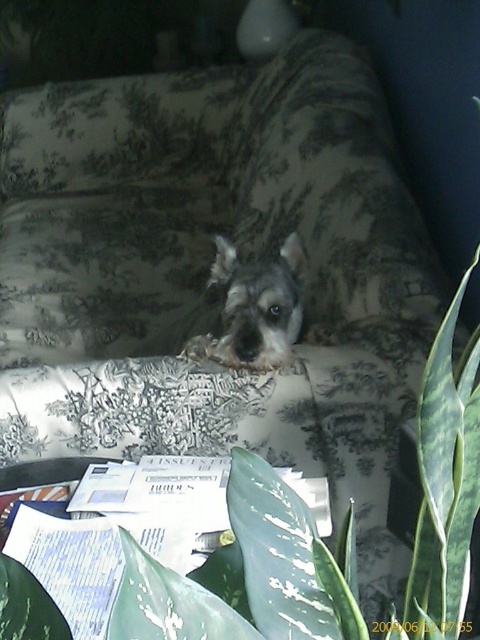
Is green leafy plant at center smaller than gray fur dog at center?

Correct, green leafy plant at center occupies less space than gray fur dog at center.

Between green leafy plant at center and gray fur dog at center, which one has less height?

Standing shorter between the two is gray fur dog at center.

Describe the element at coordinates (243, 576) in the screenshot. The image size is (480, 640). I see `green leafy plant at center` at that location.

Locate an element on the screen. The width and height of the screenshot is (480, 640). green leafy plant at center is located at coordinates [x=243, y=576].